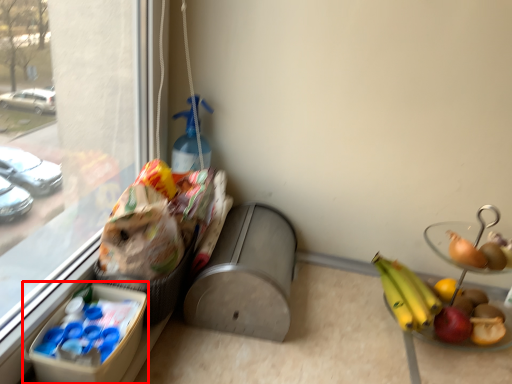
Question: From the image's perspective, considering the relative positions of lunch box (annotated by the red box) and basket in the image provided, where is lunch box (annotated by the red box) located with respect to the staircase?

Choices:
 (A) below
 (B) above

Answer: (A)